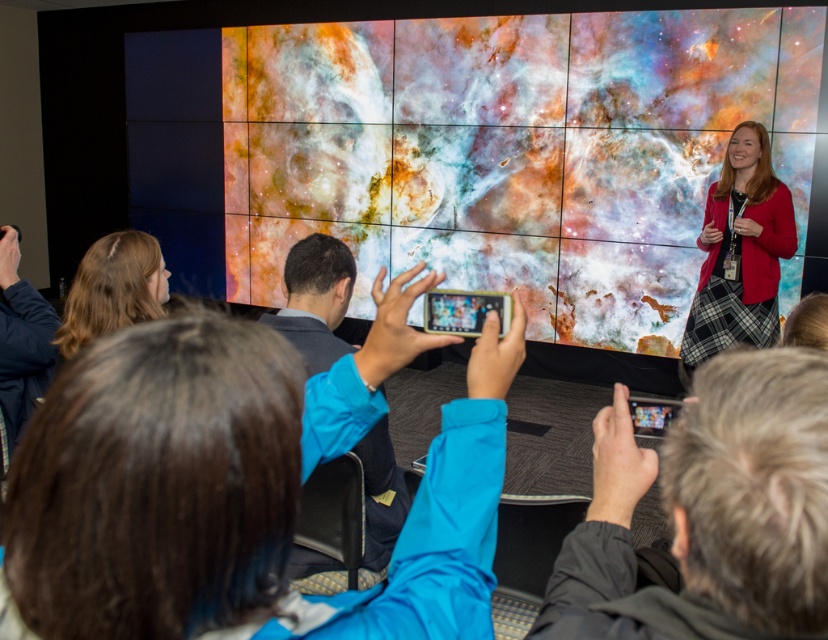
Is blonde hair at left bigger than matte black tablet at center?

Yes.

Between blonde hair at left and matte black tablet at center, which one has more height?

Standing taller between the two is blonde hair at left.

At what (x,y) coordinates should I click in order to perform the action: click on blonde hair at left. Please return your answer as a coordinate pair (x, y). Image resolution: width=828 pixels, height=640 pixels. Looking at the image, I should click on (112, 289).

Can you confirm if blue fabric jacket at center is positioned above gray fabric jacket at lower right?

Yes.

How far apart are blue fabric jacket at center and gray fabric jacket at lower right?

A distance of 26.33 centimeters exists between blue fabric jacket at center and gray fabric jacket at lower right.

Locate an element on the screen. Image resolution: width=828 pixels, height=640 pixels. blue fabric jacket at center is located at coordinates (119, 476).

Who is positioned more to the left, multicolored fabric screen at center or blue fabric jacket at center?

Positioned to the left is multicolored fabric screen at center.

Does multicolored fabric screen at center appear on the left side of blue fabric jacket at center?

Indeed, multicolored fabric screen at center is positioned on the left side of blue fabric jacket at center.

The image size is (828, 640). What do you see at coordinates (470, 148) in the screenshot?
I see `multicolored fabric screen at center` at bounding box center [470, 148].

At what (x,y) coordinates should I click in order to perform the action: click on multicolored fabric screen at center. Please return your answer as a coordinate pair (x, y). The height and width of the screenshot is (640, 828). Looking at the image, I should click on (470, 148).